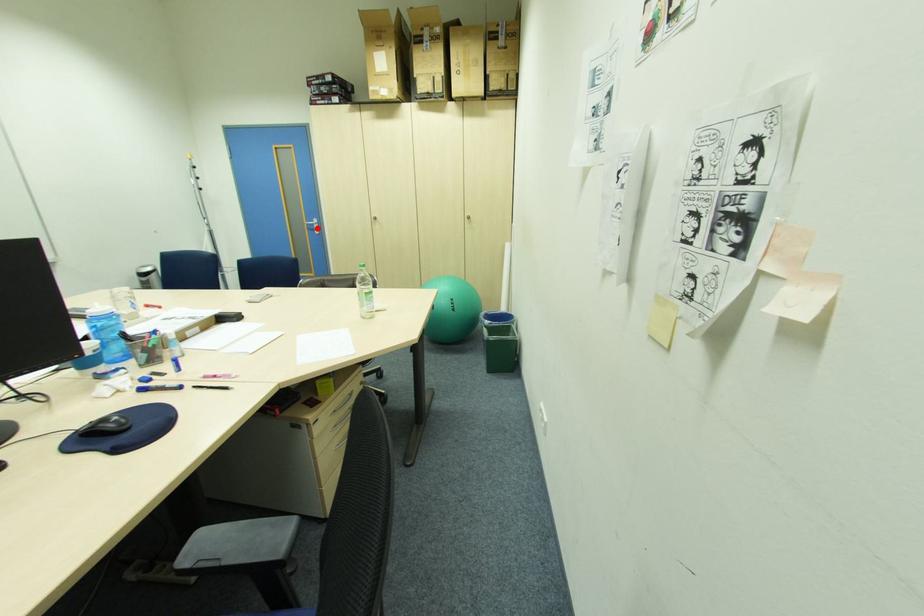
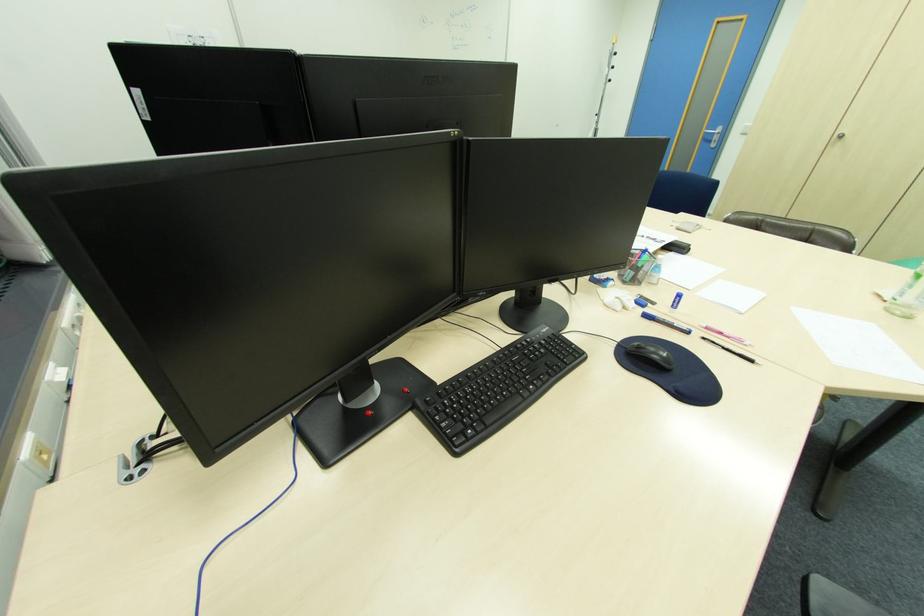
The point at the highlighted location is marked in the first image. Where is the corresponding point in the second image?

(713, 139)